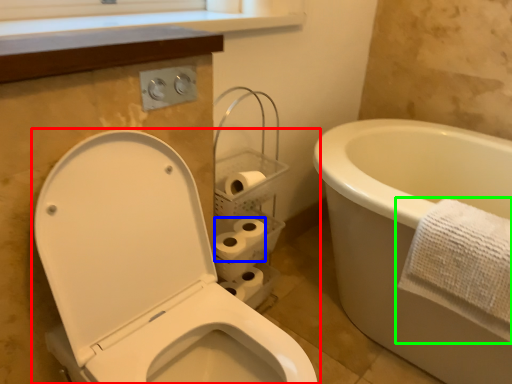
Question: Considering the real-world distances, which object is farthest from toilet (highlighted by a red box)? toilet paper (highlighted by a blue box) or towel (highlighted by a green box)?

Choices:
 (A) toilet paper
 (B) towel

Answer: (B)